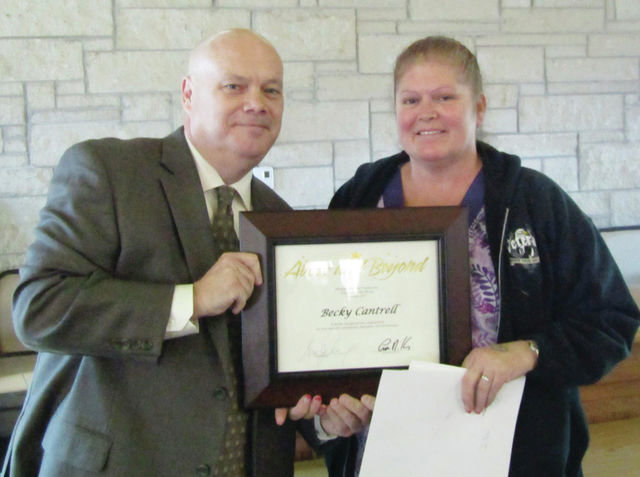
Find the location of a particular element. wall is located at coordinates (312, 126).